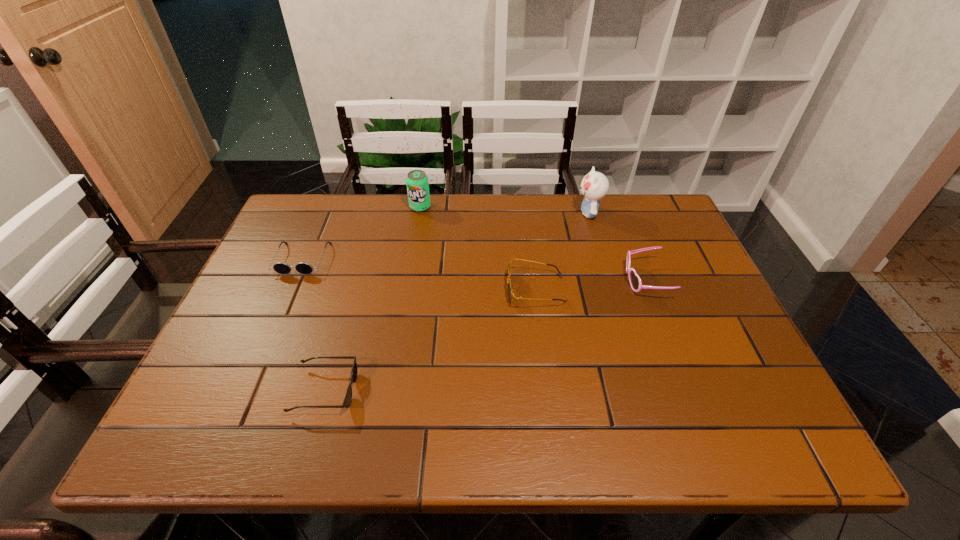
In the image, there is a desktop. Identify the location of vacant space at the near right corner. Image resolution: width=960 pixels, height=540 pixels. (714, 442).

The image size is (960, 540). Find the location of `free area in between the leftmost sunglasses and the tallest object`. free area in between the leftmost sunglasses and the tallest object is located at coordinates (445, 236).

This screenshot has height=540, width=960. Identify the location of vacant area that lies between the second tallest object and the third sunglasses from left to right. (478, 248).

Find the location of a particular element. This screenshot has width=960, height=540. free space between the rightmost sunglasses and the fifth shortest object is located at coordinates (533, 244).

Locate an element on the screen. The height and width of the screenshot is (540, 960). vacant space that is in between the fourth object from left to right and the third sunglasses from right to left is located at coordinates point(430,340).

Locate an element on the screen. This screenshot has height=540, width=960. vacant point located between the rightmost object and the fifth object from right to left is located at coordinates (485, 335).

The image size is (960, 540). In order to click on vacant space in between the tallest object and the fifth shortest object in this screenshot , I will do `click(504, 210)`.

At what (x,y) coordinates should I click in order to perform the action: click on vacant point located between the leftmost sunglasses and the pop soda. Please return your answer as a coordinate pair (x, y). This screenshot has width=960, height=540. Looking at the image, I should click on (362, 233).

The height and width of the screenshot is (540, 960). I want to click on free space that is in between the rightmost sunglasses and the third object from left to right, so click(x=533, y=244).

The width and height of the screenshot is (960, 540). In order to click on free space that is in between the fifth object from right to left and the kitten in this screenshot , I will do (457, 302).